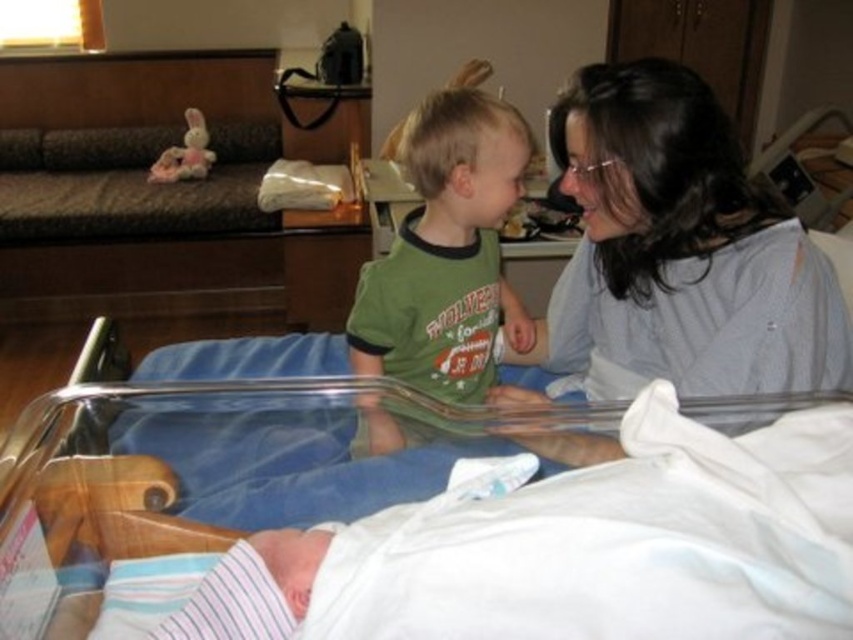
Question: Observing the image, what is the correct spatial positioning of matte gray shirt at upper right in reference to white fabric infant bed at center?

Choices:
 (A) right
 (B) left

Answer: (A)

Question: Among these points, which one is farthest from the camera?

Choices:
 (A) (669, 337)
 (B) (350, 413)

Answer: (A)

Question: Can you confirm if matte gray shirt at upper right is positioned above white fabric infant bed at center?

Choices:
 (A) yes
 (B) no

Answer: (A)

Question: Considering the real-world distances, which object is closest to the matte gray shirt at upper right?

Choices:
 (A) green cotton shirt at center
 (B) white fabric infant bed at center

Answer: (A)

Question: Is the position of matte gray shirt at upper right less distant than that of white fabric infant bed at center?

Choices:
 (A) no
 (B) yes

Answer: (A)

Question: Which of the following is the closest to the observer?

Choices:
 (A) matte gray shirt at upper right
 (B) green cotton shirt at center
 (C) white fabric infant bed at center

Answer: (C)